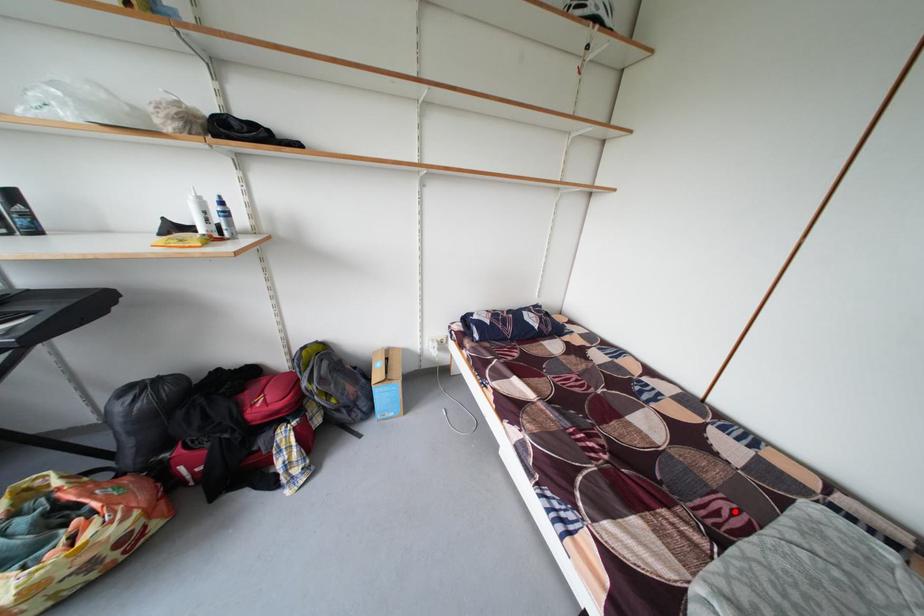
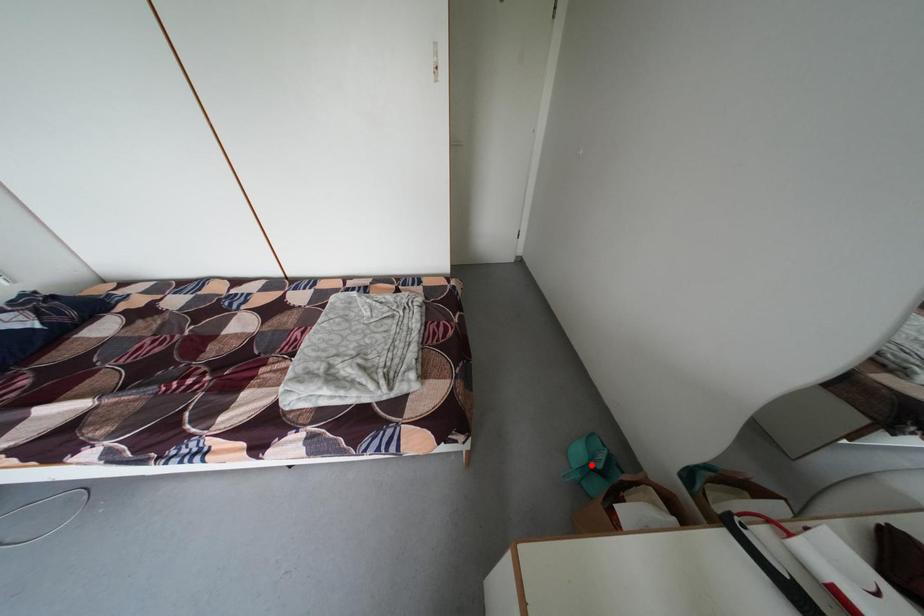
I am providing you with two images of the same scene from different viewpoints. A red point is marked on the first image and another point is marked on the second image. Are the points marked in image1 and image2 representing the same 3D position?

No